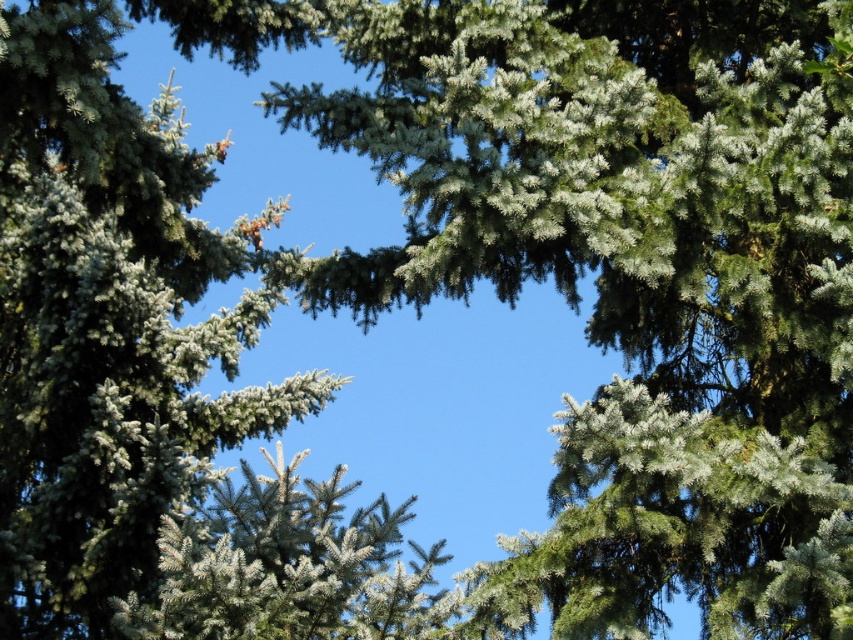
Question: Which object appears closest to the camera in this image?

Choices:
 (A) green needle-like at upper left
 (B) green needle-like at center

Answer: (B)

Question: Is green needle-like at upper left thinner than green needle-like at center?

Choices:
 (A) yes
 (B) no

Answer: (A)

Question: Does green needle-like at upper left have a larger size compared to green needle-like at center?

Choices:
 (A) yes
 (B) no

Answer: (B)

Question: Can you confirm if green needle-like at upper left is positioned to the left of green needle-like at center?

Choices:
 (A) no
 (B) yes

Answer: (B)

Question: Which point is farther to the camera?

Choices:
 (A) green needle-like at upper left
 (B) green needle-like at center

Answer: (A)

Question: Which point is closer to the camera taking this photo?

Choices:
 (A) (357, 572)
 (B) (9, 8)

Answer: (B)